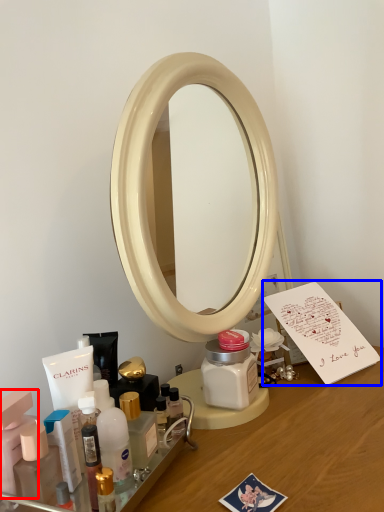
Question: Among these objects, which one is nearest to the camera, toiletry (highlighted by a red box) or postcard (highlighted by a blue box)?

Choices:
 (A) toiletry
 (B) postcard

Answer: (A)